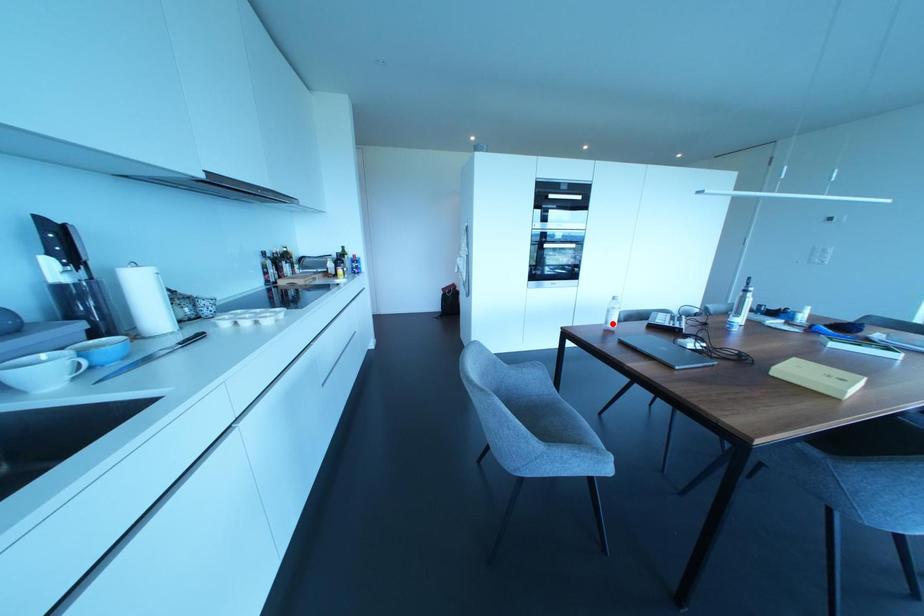
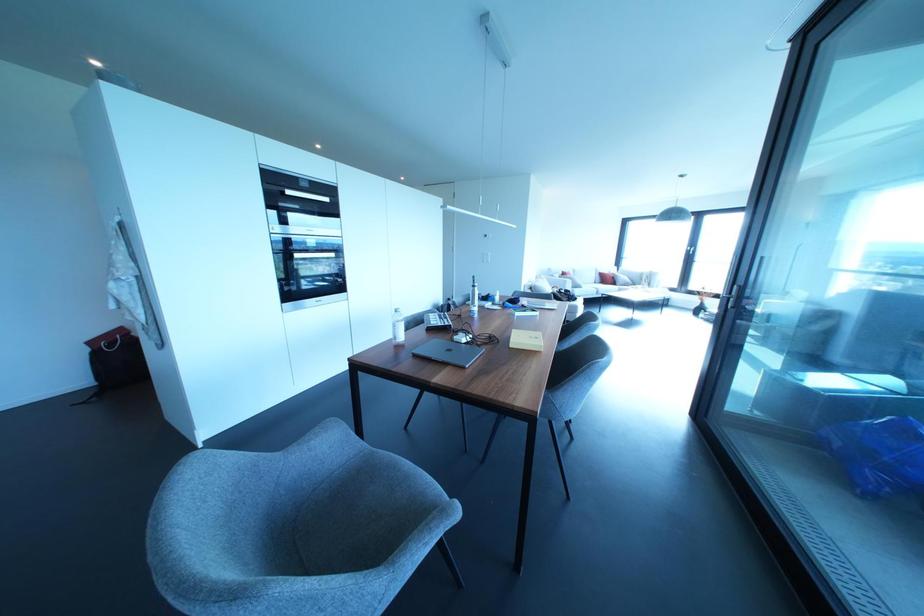
Where in the second image is the point corresponding to the highlighted location from the first image?

(400, 337)